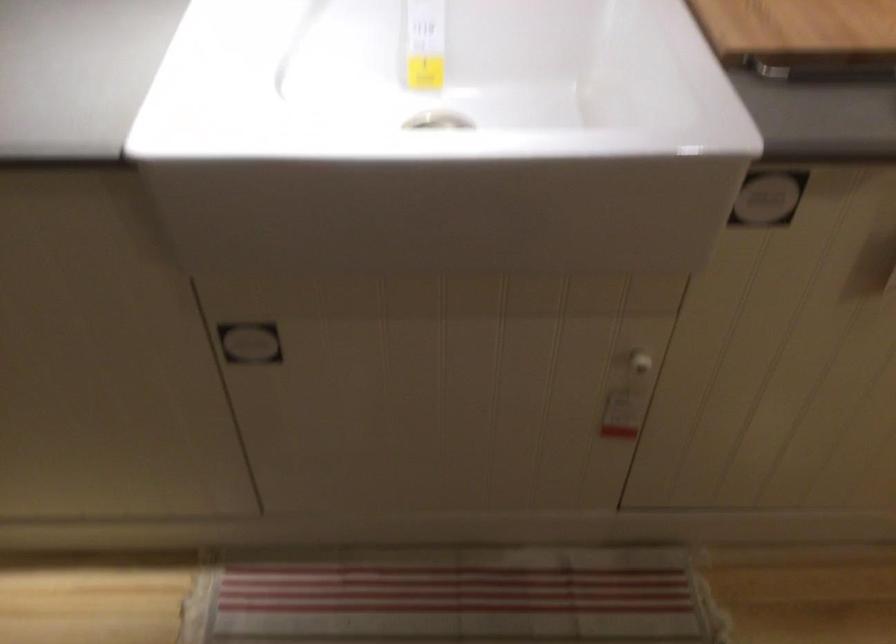
The first image is from the beginning of the video and the second image is from the end. How did the camera likely rotate when shooting the video?

The rotation direction of the camera is left-up.